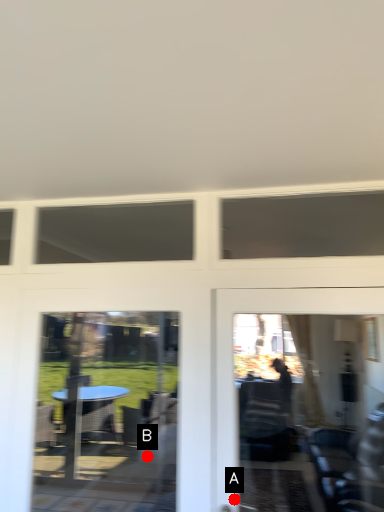
Question: Two points are circled on the image, labeled by A and B beside each circle. Which of the following is the farthest from the observer?

Choices:
 (A) A is further
 (B) B is further

Answer: (B)